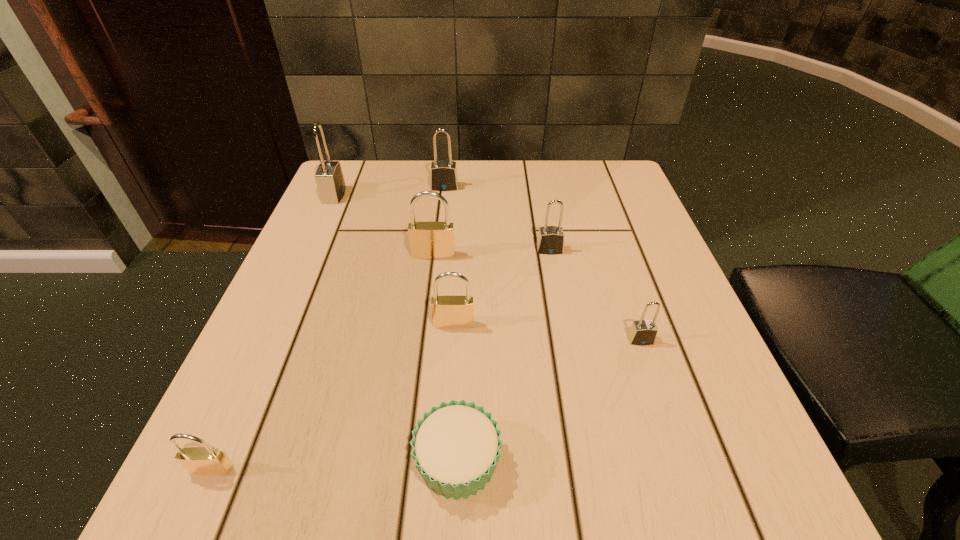
Locate an element on the screen. The image size is (960, 540). blank area at the near left corner is located at coordinates (284, 494).

The width and height of the screenshot is (960, 540). I want to click on free location at the far right corner of the desktop, so click(x=576, y=196).

The width and height of the screenshot is (960, 540). In the image, there is a desktop. In order to click on vacant space at the near right corner in this screenshot , I will do `click(739, 514)`.

The width and height of the screenshot is (960, 540). In order to click on vacant space that's between the biggest gray padlock and the third nearest padlock in this screenshot , I will do `click(394, 259)`.

Where is `vacant area that lies between the biggest brass padlock and the biggest gray padlock`? The height and width of the screenshot is (540, 960). vacant area that lies between the biggest brass padlock and the biggest gray padlock is located at coordinates (384, 225).

Identify the location of empty location between the second biggest brass padlock and the sixth padlock from left to right. The width and height of the screenshot is (960, 540). (502, 287).

The height and width of the screenshot is (540, 960). Identify the location of free space between the third gray padlock from right to left and the nearest brass padlock. (328, 328).

Where is `free space that is in between the smallest gray padlock and the leftmost brass padlock`? free space that is in between the smallest gray padlock and the leftmost brass padlock is located at coordinates (426, 404).

Identify the location of unoccupied position between the smallest brass padlock and the second padlock from right to left. (380, 360).

This screenshot has width=960, height=540. I want to click on vacant point located between the nearest gray padlock and the nearest brass padlock, so click(426, 404).